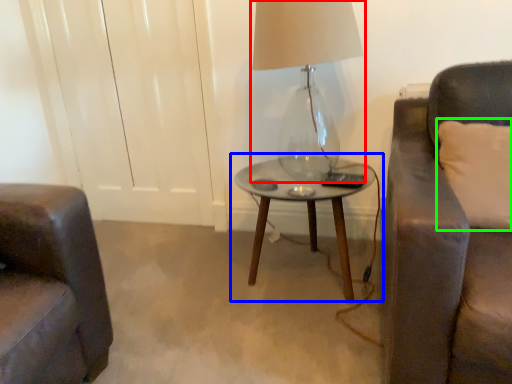
Question: Which is nearer to the lamp (highlighted by a red box)? table (highlighted by a blue box) or pillow (highlighted by a green box).

Choices:
 (A) table
 (B) pillow

Answer: (A)